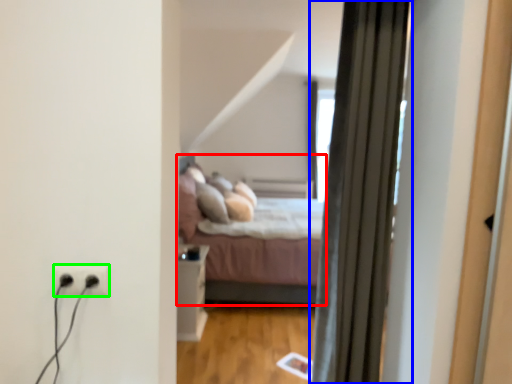
Question: Which is farther away from bed (highlighted by a red box)? curtain (highlighted by a blue box) or electric outlet (highlighted by a green box)?

Choices:
 (A) curtain
 (B) electric outlet

Answer: (B)